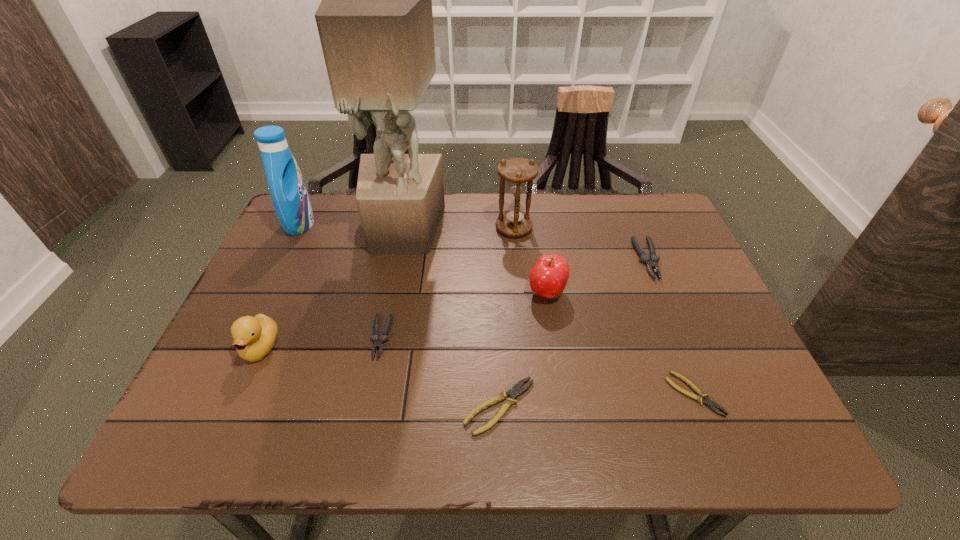
Locate an element on the screen. The image size is (960, 540). unoccupied area between the second tallest pliers and the apple is located at coordinates (464, 315).

Locate an element on the screen. Image resolution: width=960 pixels, height=540 pixels. free space between the second tallest pliers and the hourglass is located at coordinates (447, 283).

Find the location of a particular element. Image resolution: width=960 pixels, height=540 pixels. free space between the apple and the sculpture is located at coordinates (475, 261).

This screenshot has height=540, width=960. Identify the location of vacant area that lies between the red apple and the bigger gray pliers. (597, 276).

Identify the location of free space that is in between the nearer gray pliers and the farthest pliers. This screenshot has width=960, height=540. (514, 299).

Where is `vacant space that's between the tallest object and the apple`? The width and height of the screenshot is (960, 540). vacant space that's between the tallest object and the apple is located at coordinates (475, 261).

You are a GUI agent. You are given a task and a screenshot of the screen. Output one action in this format:
    pyautogui.click(x=<x>, y=<y>)
    Task: Click on the free space between the third nearest pliers and the eighth shortest object
    This screenshot has width=960, height=540.
    Given the screenshot: What is the action you would take?
    pyautogui.click(x=340, y=281)

The image size is (960, 540). Identify the location of empty space between the right yellow pliers and the duckling. (477, 371).

This screenshot has height=540, width=960. I want to click on object that can be found as the third closest to the eighth shortest object, so click(378, 343).

I want to click on object that is the seventh closest one to the gray sculpture, so click(x=651, y=262).